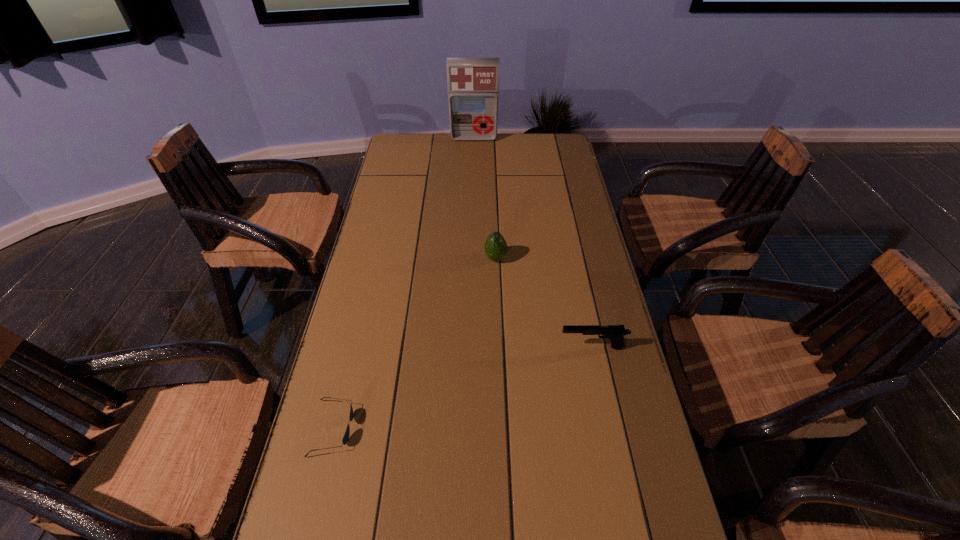
Identify the location of vacant space located at the aiming end of the rightmost object. (502, 347).

Where is `free space located 0.320m at the aiming end of the rightmost object`? The width and height of the screenshot is (960, 540). free space located 0.320m at the aiming end of the rightmost object is located at coordinates (436, 347).

Where is `free location located on the lenses of the leftmost object`? The image size is (960, 540). free location located on the lenses of the leftmost object is located at coordinates (419, 428).

This screenshot has width=960, height=540. I want to click on object positioned at the far edge, so point(473,83).

The height and width of the screenshot is (540, 960). I want to click on object at the left edge, so click(x=345, y=439).

In order to click on object that is positioned at the right edge in this screenshot , I will do `click(616, 333)`.

This screenshot has height=540, width=960. Identify the location of vacant region at the far edge of the desktop. (498, 139).

The width and height of the screenshot is (960, 540). I want to click on vacant space at the left edge of the desktop, so click(x=317, y=475).

This screenshot has width=960, height=540. I want to click on blank space at the right edge, so click(x=589, y=422).

Locate an element on the screen. The height and width of the screenshot is (540, 960). vacant position at the far left corner of the desktop is located at coordinates (396, 143).